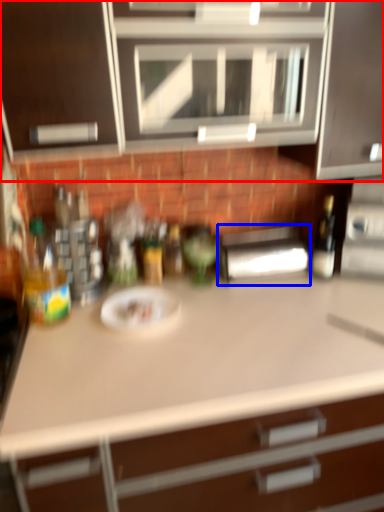
Question: Which point is further to the camera, cabinetry (highlighted by a red box) or appliance (highlighted by a blue box)?

Choices:
 (A) cabinetry
 (B) appliance

Answer: (B)